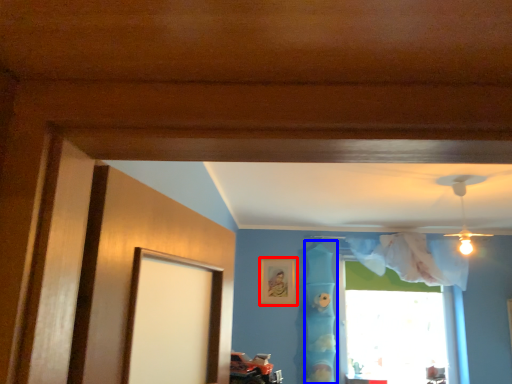
Question: Which object is further to the camera taking this photo, picture frame (highlighted by a red box) or curtain (highlighted by a blue box)?

Choices:
 (A) picture frame
 (B) curtain

Answer: (A)